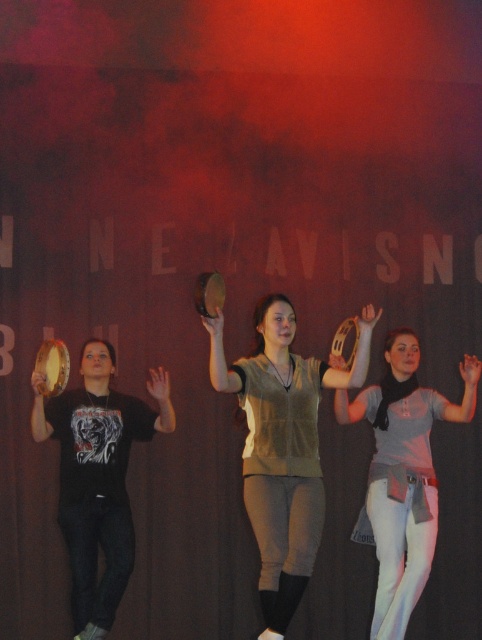
Can you confirm if velvet beige vest at center is taller than light gray cotton shirt at center?

Incorrect, velvet beige vest at center's height is not larger of light gray cotton shirt at center's.

Identify the location of velvet beige vest at center. Image resolution: width=482 pixels, height=640 pixels. (282, 445).